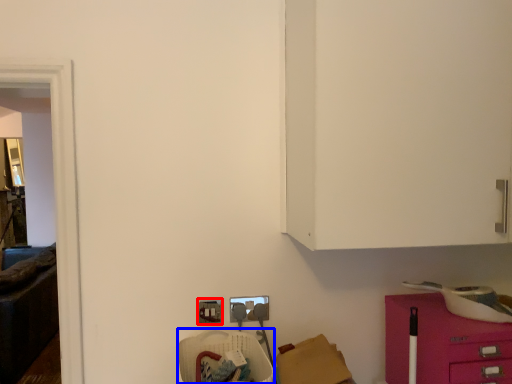
Question: Which object is closer to the camera taking this photo, electric outlet (highlighted by a red box) or armchair (highlighted by a blue box)?

Choices:
 (A) electric outlet
 (B) armchair

Answer: (B)